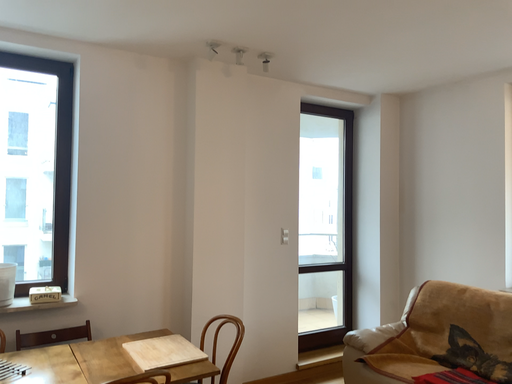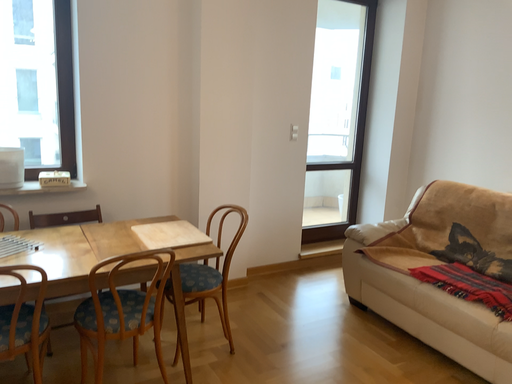
Question: Which way did the camera rotate in the video?

Choices:
 (A) rotated downward
 (B) rotated upward

Answer: (A)